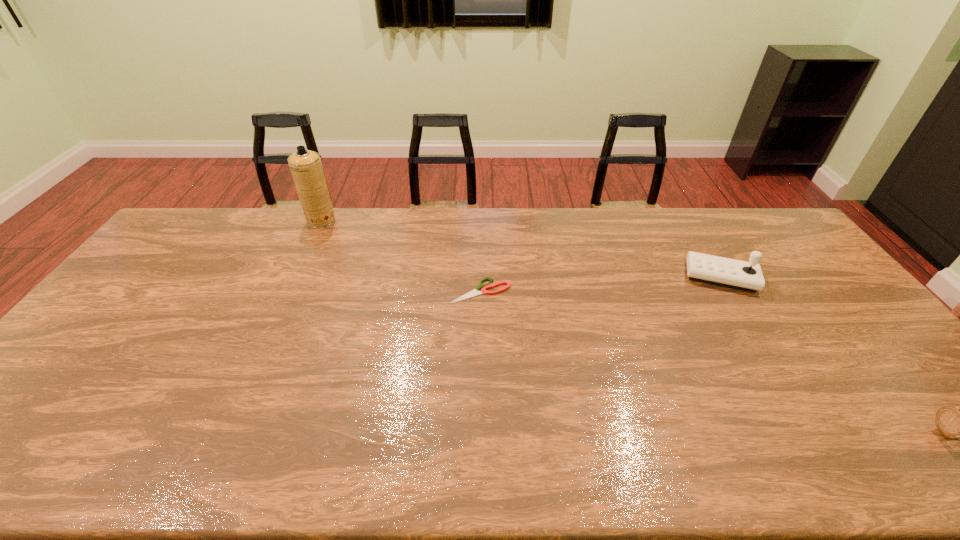
In the image, there is a desktop. Where is `vacant space at the near edge`? This screenshot has width=960, height=540. vacant space at the near edge is located at coordinates (692, 443).

Locate an element on the screen. This screenshot has width=960, height=540. free space at the right edge of the desktop is located at coordinates (854, 372).

This screenshot has width=960, height=540. Find the location of `vacant space at the far right corner of the desktop`. vacant space at the far right corner of the desktop is located at coordinates (760, 231).

You are a GUI agent. You are given a task and a screenshot of the screen. Output one action in this format:
    pyautogui.click(x=<x>, y=<y>)
    Task: Click on the vacant area between the second object from right to left and the shortest object
    
    Given the screenshot: What is the action you would take?
    pyautogui.click(x=600, y=284)

The height and width of the screenshot is (540, 960). What are the coordinates of `vacant space that's between the shortest object and the second object from right to left` in the screenshot? It's located at (600, 284).

Locate an element on the screen. free spot between the third object from right to left and the third object from left to right is located at coordinates (600, 284).

Where is `unoccupied position between the scissors and the joystick`? Image resolution: width=960 pixels, height=540 pixels. unoccupied position between the scissors and the joystick is located at coordinates (600, 284).

The image size is (960, 540). I want to click on blank region between the second object from right to left and the scissors, so click(600, 284).

The width and height of the screenshot is (960, 540). What are the coordinates of `free space that is in between the scissors and the aerosol can` in the screenshot? It's located at (x=400, y=256).

Identify which object is located as the third nearest to the aerosol can. Please provide its 2D coordinates. Your answer should be formatted as a tuple, i.e. [(x, y)], where the tuple contains the x and y coordinates of a point satisfying the conditions above.

[(954, 422)]